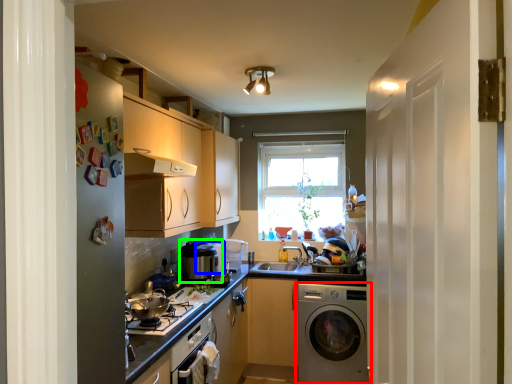
Question: Based on their relative distances, which object is farther from washing machine (highlighted by a red box)? Choose from appliance (highlighted by a blue box) and appliance (highlighted by a green box).

Choices:
 (A) appliance
 (B) appliance

Answer: (B)